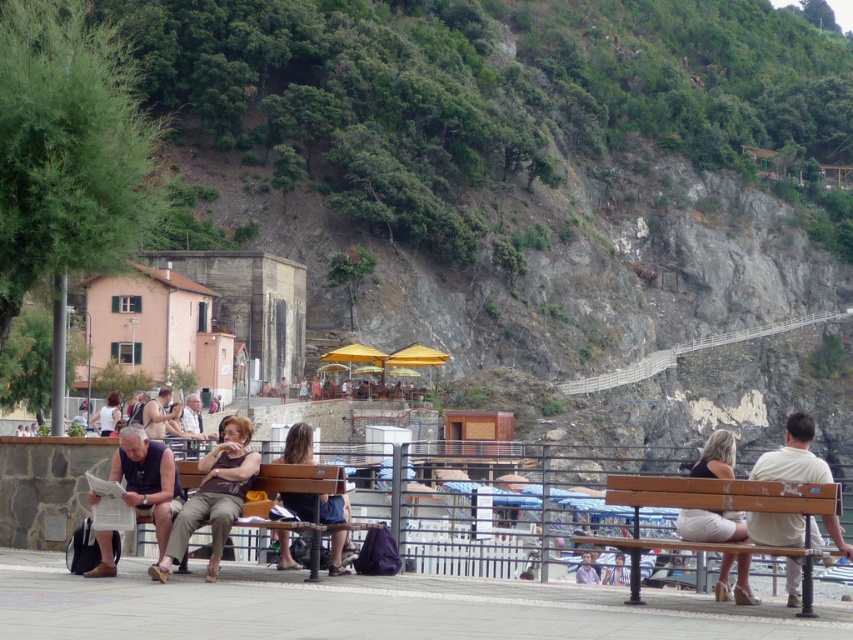
Question: Does brown wooden bench at center come behind matte brown tank top at center?

Choices:
 (A) no
 (B) yes

Answer: (A)

Question: Is light beige fabric skirt at center closer to the viewer compared to matte brown tank top at center?

Choices:
 (A) yes
 (B) no

Answer: (A)

Question: Which of the following is the closest to the observer?

Choices:
 (A) (164, 404)
 (B) (163, 568)

Answer: (B)

Question: Estimate the real-world distances between objects in this image. Which object is farther from the matte brown tank top at center?

Choices:
 (A) white cotton shirt at right
 (B) matte brown pants at center
 (C) brown wooden bench at center
 (D) light brown leather jacket at lower center

Answer: (A)

Question: Can you confirm if wooden bench at center is positioned above light brown leather jacket at lower center?

Choices:
 (A) no
 (B) yes

Answer: (B)

Question: Considering the real-world distances, which object is farthest from the matte brown tank top at center?

Choices:
 (A) light brown leather jacket at lower center
 (B) wooden bench at center
 (C) matte brown pants at center
 (D) dark brown leather bag at center

Answer: (B)